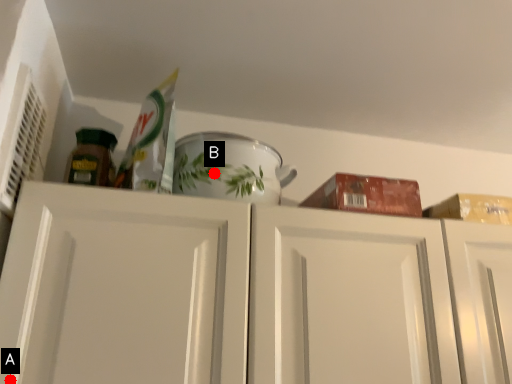
Question: Two points are circled on the image, labeled by A and B beside each circle. Among these points, which one is farthest from the camera?

Choices:
 (A) A is further
 (B) B is further

Answer: (B)